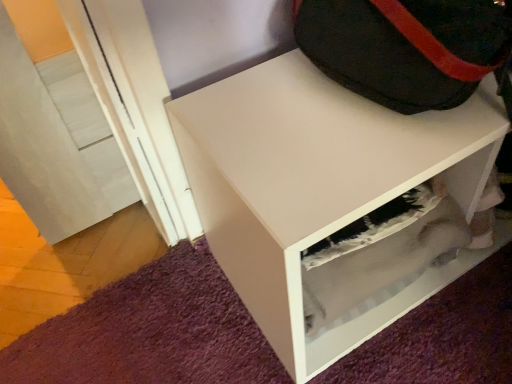
This screenshot has width=512, height=384. Identify the location of white matte storage unit at center. (320, 187).

The width and height of the screenshot is (512, 384). Describe the element at coordinates (320, 187) in the screenshot. I see `white matte storage unit at center` at that location.

Locate an element on the screen. This screenshot has height=384, width=512. white matte storage unit at center is located at coordinates (320, 187).